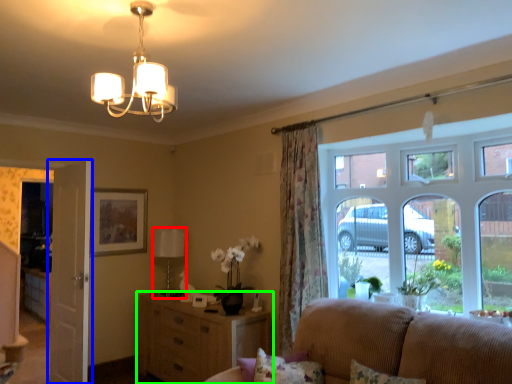
Question: Which object is the farthest from lamp (highlighted by a red box)? Choose among these: door (highlighted by a blue box) or cabinetry (highlighted by a green box).

Choices:
 (A) door
 (B) cabinetry

Answer: (A)